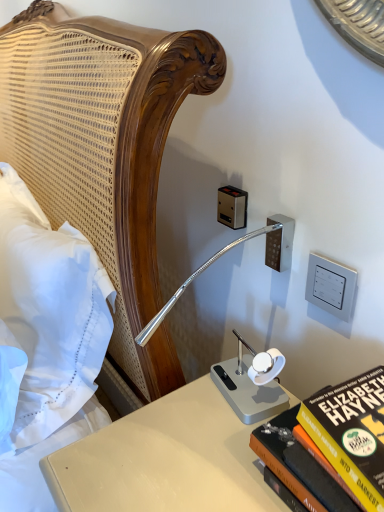
Question: Should I look upward or downward to see hardcover book at lower right?

Choices:
 (A) up
 (B) down

Answer: (B)

Question: Is hardcover book at lower right not inside white plastic switch at upper right, the first electric outlet positioned from the front?

Choices:
 (A) yes
 (B) no

Answer: (A)

Question: Considering the relative positions of hardcover book at lower right and white plastic switch at upper right, the first electric outlet positioned from the front, in the image provided, is hardcover book at lower right behind white plastic switch at upper right, the first electric outlet positioned from the front,?

Choices:
 (A) yes
 (B) no

Answer: (B)

Question: Is hardcover book at lower right smaller than white plastic switch at upper right, the 1th electric outlet positioned from the right?

Choices:
 (A) no
 (B) yes

Answer: (A)

Question: Is hardcover book at lower right surrounding white plastic switch at upper right, which ranks as the 2th electric outlet in back-to-front order?

Choices:
 (A) yes
 (B) no

Answer: (B)

Question: Does hardcover book at lower right have a greater height compared to white plastic switch at upper right, which ranks as the 2th electric outlet in back-to-front order?

Choices:
 (A) yes
 (B) no

Answer: (A)

Question: Is hardcover book at lower right closer to camera compared to white plastic switch at upper right, which ranks as the 2th electric outlet in back-to-front order?

Choices:
 (A) yes
 (B) no

Answer: (A)

Question: Considering the relative sizes of hardcover book at lower right and white cotton pillow at left in the image provided, is hardcover book at lower right bigger than white cotton pillow at left?

Choices:
 (A) yes
 (B) no

Answer: (B)

Question: Is hardcover book at lower right looking in the opposite direction of white cotton pillow at left?

Choices:
 (A) no
 (B) yes

Answer: (A)

Question: Considering the relative sizes of hardcover book at lower right and white cotton pillow at left in the image provided, is hardcover book at lower right shorter than white cotton pillow at left?

Choices:
 (A) no
 (B) yes

Answer: (B)

Question: Considering the relative sizes of hardcover book at lower right and white cotton pillow at left in the image provided, is hardcover book at lower right wider than white cotton pillow at left?

Choices:
 (A) yes
 (B) no

Answer: (B)

Question: Can white cotton pillow at left be found inside hardcover book at lower right?

Choices:
 (A) yes
 (B) no

Answer: (B)

Question: Is hardcover book at lower right next to white cotton pillow at left?

Choices:
 (A) no
 (B) yes

Answer: (A)

Question: Can you confirm if metallic silver outlet at upper center, arranged as the second electric outlet when viewed from the front, is thinner than white cotton pillow at left?

Choices:
 (A) yes
 (B) no

Answer: (A)